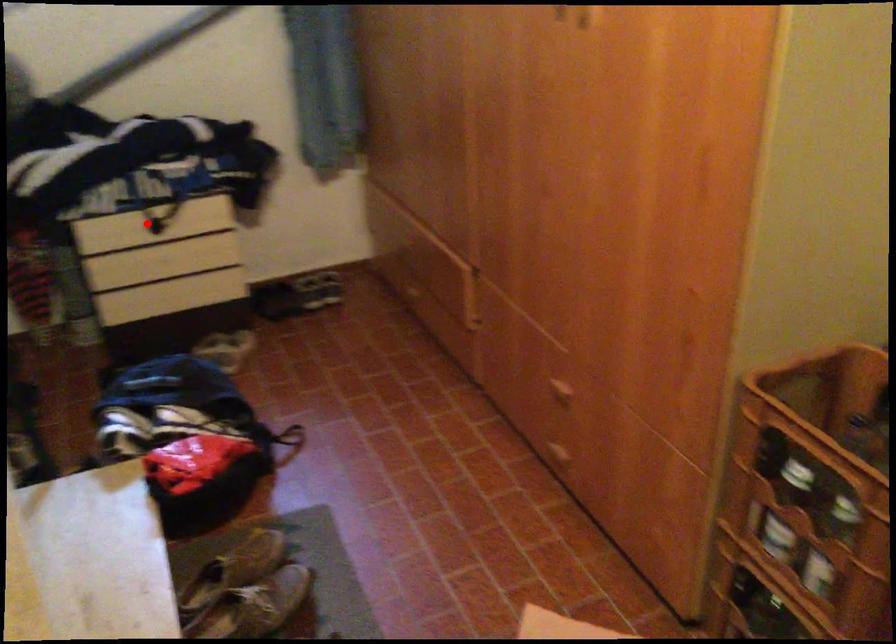
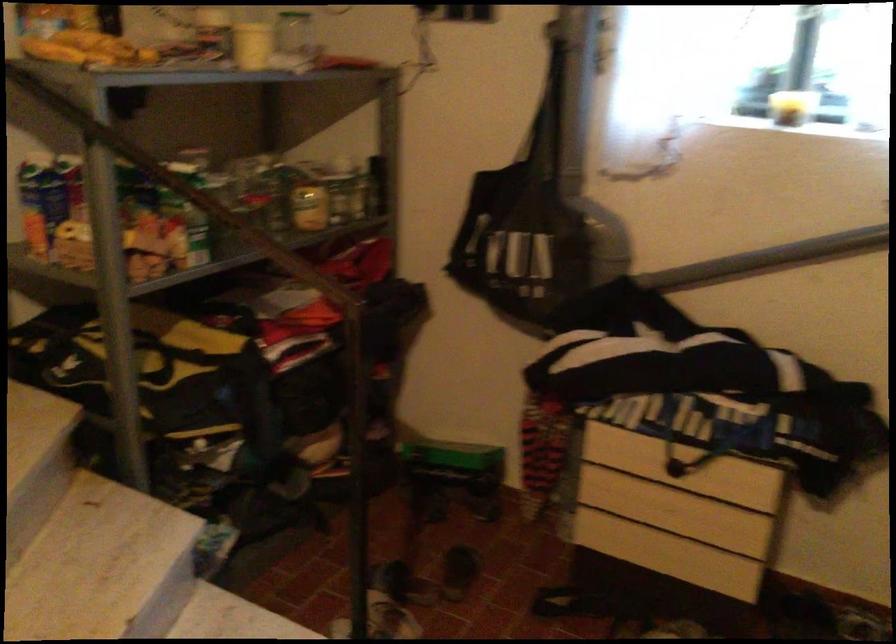
The point at the highlighted location is marked in the first image. Where is the corresponding point in the second image?

(660, 456)